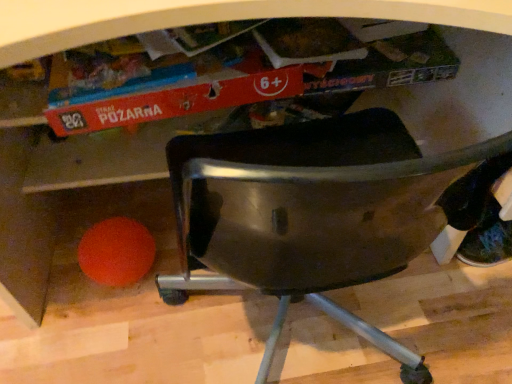
Image resolution: width=512 pixels, height=384 pixels. I want to click on blank space situated above metallic black chair at center (from a real-world perspective), so click(236, 314).